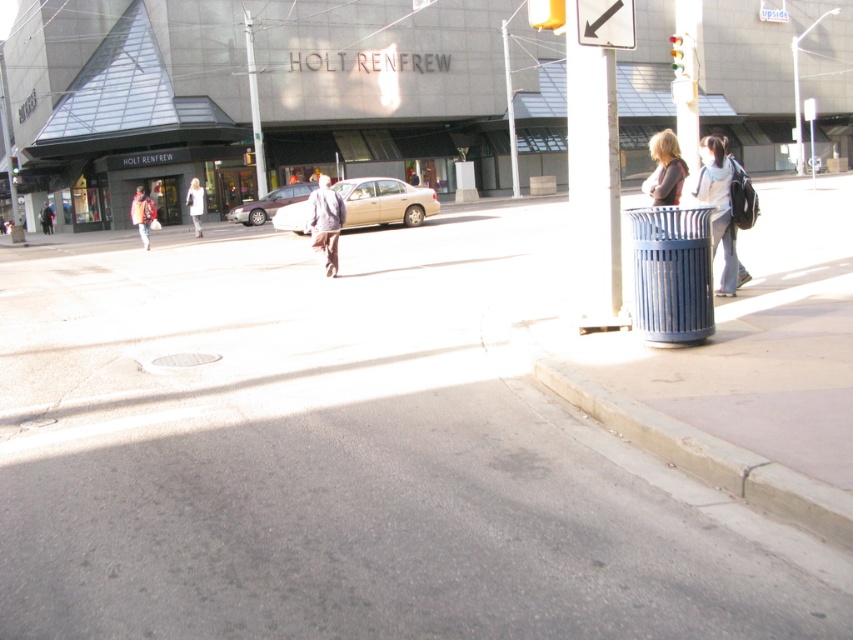
Question: Is gold metallic sedan at center smaller than white fabric backpack at right?

Choices:
 (A) yes
 (B) no

Answer: (A)

Question: Among these points, which one is farthest from the camera?

Choices:
 (A) (419, 419)
 (B) (334, 259)
 (C) (508, 108)
 (D) (204, 195)

Answer: (C)

Question: Which object is the closest to the white plastic pole at upper center?

Choices:
 (A) white metallic pole at upper center
 (B) white matte coat at center
 (C) gray asphalt pavement at center
 (D) white plastic arrow at upper center

Answer: (B)

Question: Which is farther from the white plastic arrow at upper center?

Choices:
 (A) light brown fabric jacket at center
 (B) gold metallic sedan at center

Answer: (B)

Question: Can you confirm if matte gray sweater at upper right is bigger than silver metallic sedan at center?

Choices:
 (A) yes
 (B) no

Answer: (A)

Question: Can you confirm if white fabric backpack at right is positioned below light brown fabric jacket at center?

Choices:
 (A) no
 (B) yes

Answer: (A)